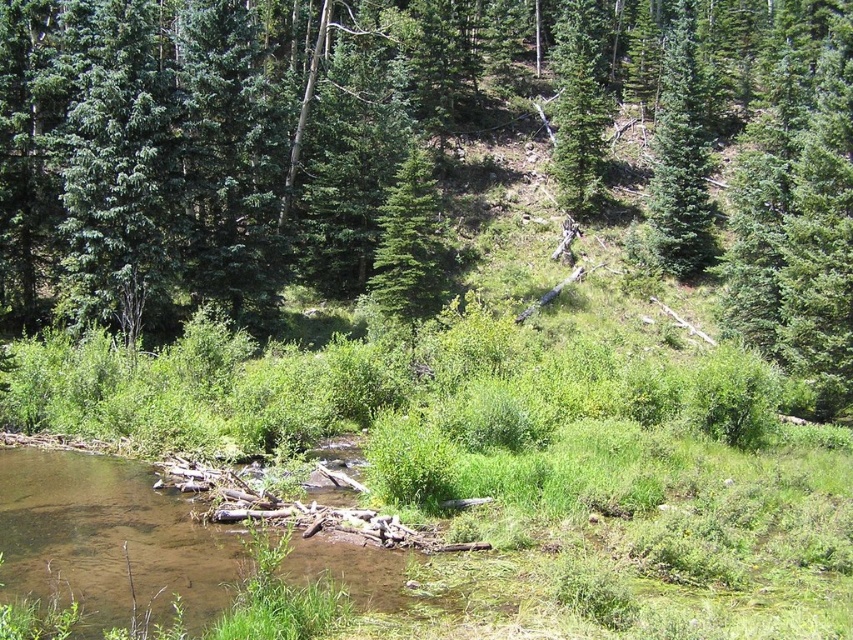
You are standing at the edge of the stream and want to cross it using the brown muddy water at lower left and the green fir tree at upper right as landmarks. Which landmark is closer to the ground level?

The brown muddy water at lower left has a lesser height compared to the green fir tree at upper right, so the brown muddy water at lower left is closer to the ground level.